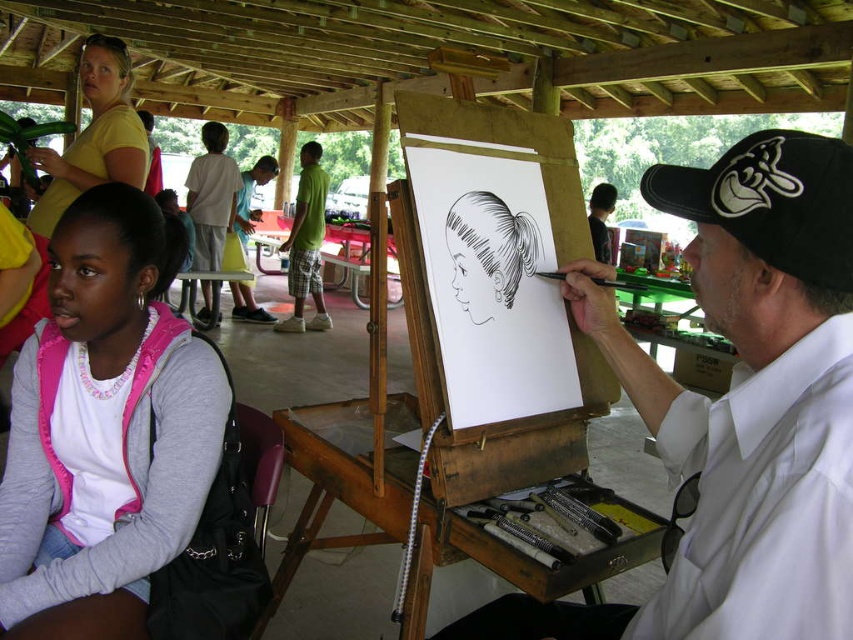
You are standing at the center of the wooden pavilion and see two points marked in the image. Which point is closer to you, point (770, 186) or point (234, 179)?

Point (770, 186) is in front of point (234, 179), so it is closer to you.